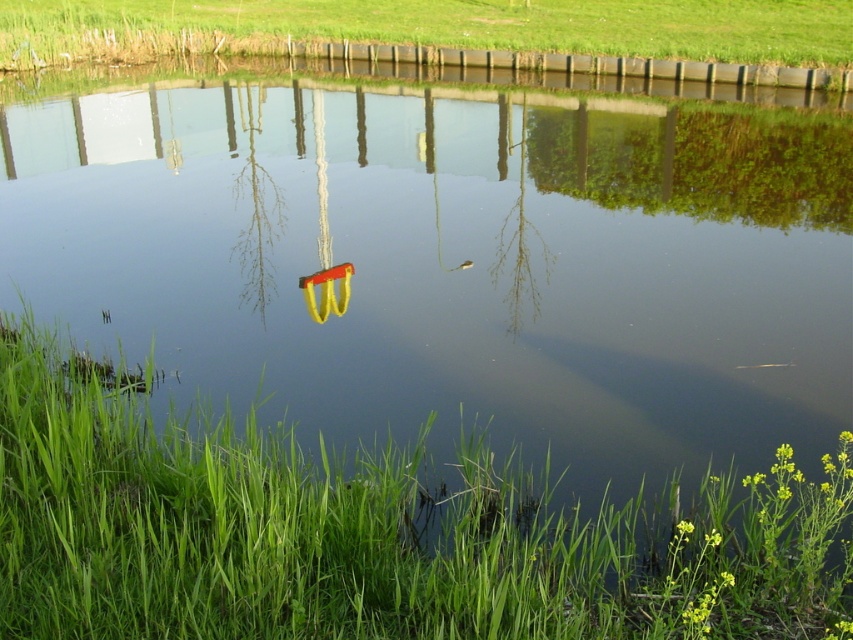
You are standing in the scene and want to place a small statue on the closest green grass area. Which area should you choose between the green grass at lower left and the green grass at upper center?

You should choose the green grass at lower left because it is closer to the viewer than the green grass at upper center.

You are standing in the scene and want to place a small garden ornament that requires 7 feet of space between it and the green grass at lower left. Is there enough space?

The green grass at lower left is 8.43 feet away from the viewer. Since the ornament needs 7 feet of space, there is sufficient distance to place it appropriately.